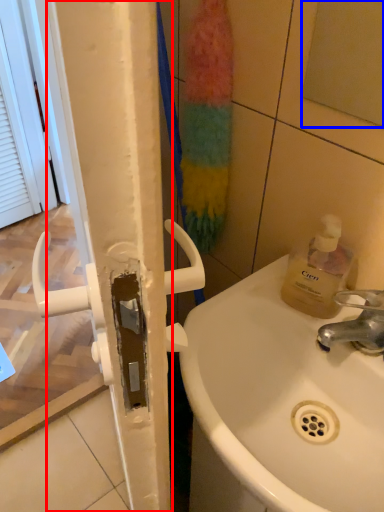
Question: Which point is further to the camera, shower door (highlighted by a red box) or mirror (highlighted by a blue box)?

Choices:
 (A) shower door
 (B) mirror

Answer: (A)